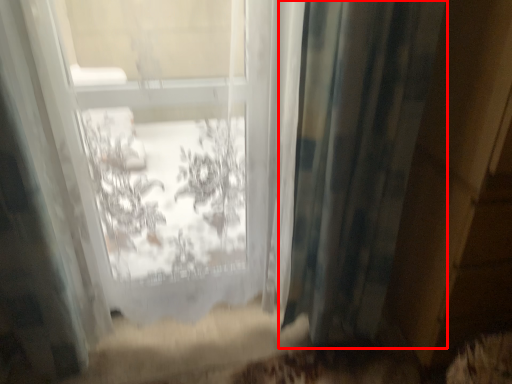
Question: Observing the image, what is the correct spatial positioning of curtain (annotated by the red box) in reference to bay window?

Choices:
 (A) right
 (B) left

Answer: (A)